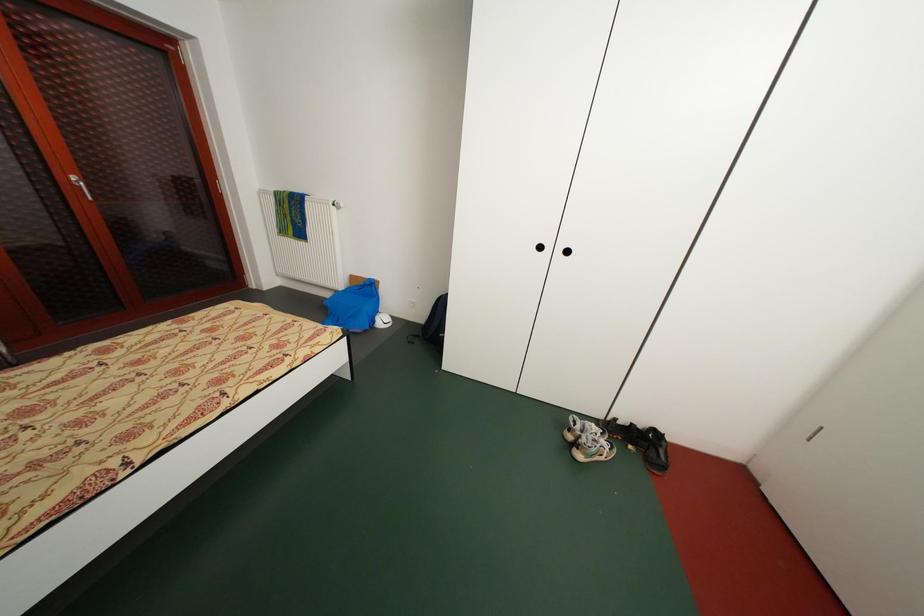
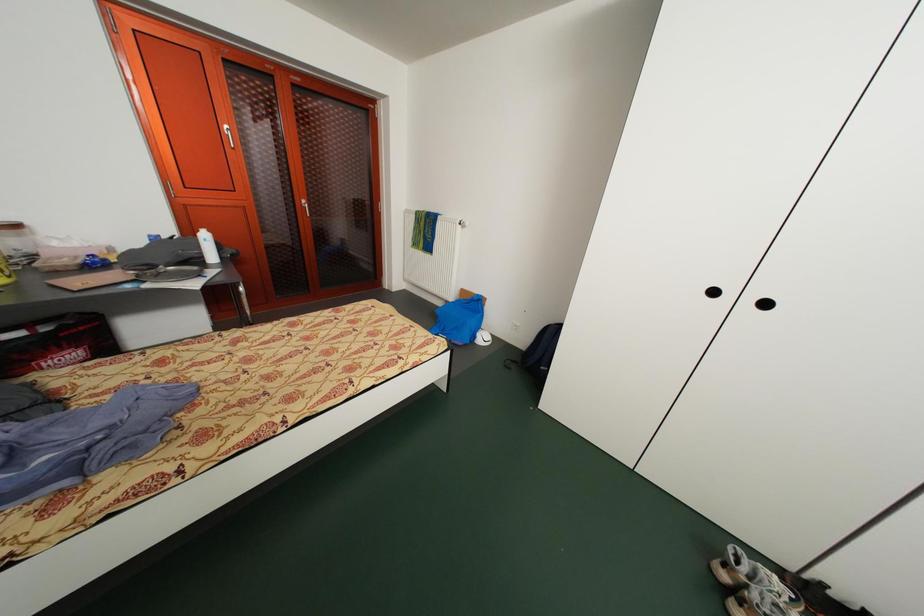
Question: The camera is either moving clockwise (left) or counter-clockwise (right) around the object. The first image is from the beginning of the video and the second image is from the end. Is the camera moving left or right when shooting the video?

Choices:
 (A) Left
 (B) Right

Answer: (B)